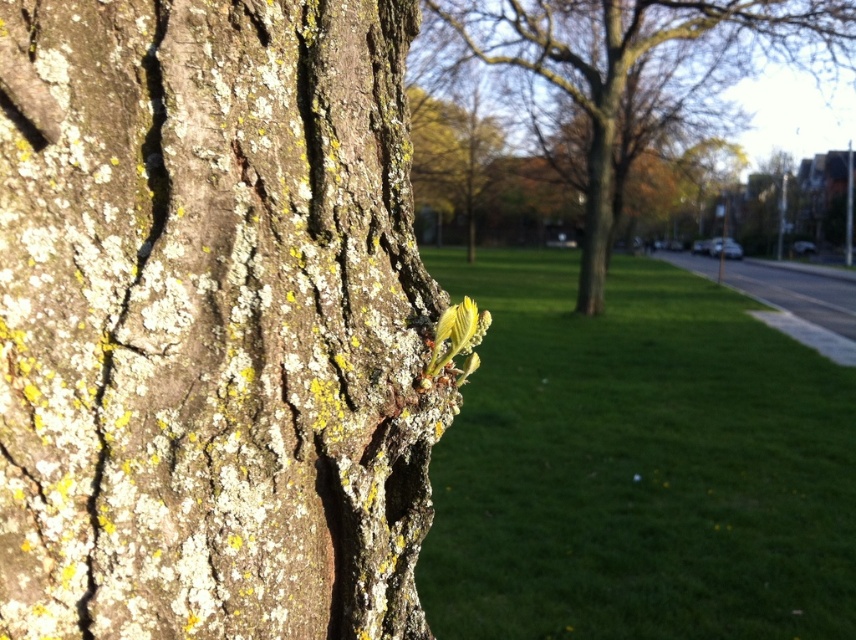
You are standing in the park and see the tree trunk on the left. If you walk towards the point marked by the coordinates point (637,465), which is the green grass at center, will you be moving away from the tree trunk on the left?

Yes, walking towards the point (637,465), which is the green grass at center, means you are moving away from the tree trunk on the left because the grass is located at the center of the image, away from the left side where the tree trunk is positioned.